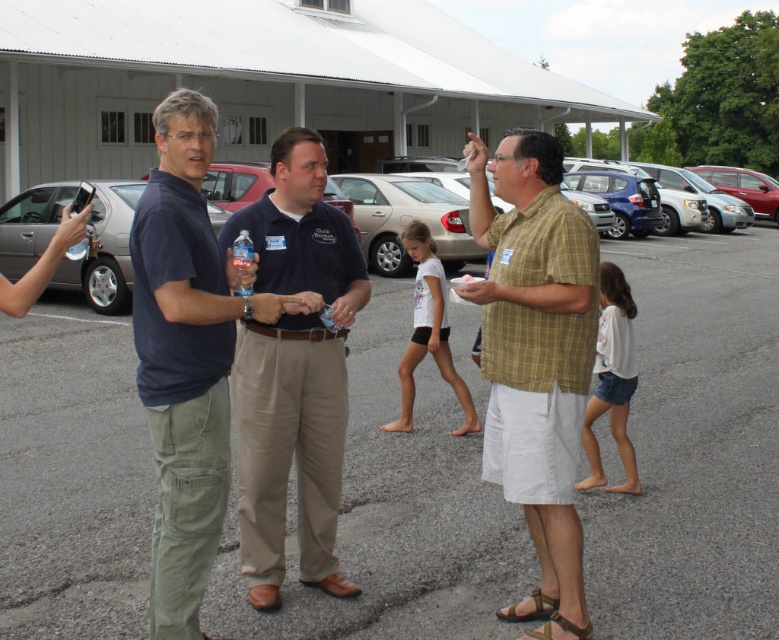
Question: Is dark blue shirt at center positioned behind metallic silver sedan at center?

Choices:
 (A) yes
 (B) no

Answer: (B)

Question: Which point is closer to the camera?

Choices:
 (A) (146, 339)
 (B) (314, 224)

Answer: (A)

Question: Which object is positioned closest to the metallic silver sedan at center?

Choices:
 (A) gray asphalt parking lot at center
 (B) yellow plaid shirt at center
 (C) dark blue shirt at center

Answer: (A)

Question: Can you confirm if yellow plaid shirt at center is positioned above khaki cotton pants at center?

Choices:
 (A) yes
 (B) no

Answer: (B)

Question: Which of the following is the closest to the observer?

Choices:
 (A) (686, 323)
 (B) (716, 237)

Answer: (A)

Question: Is yellow plaid shirt at center below dark blue shirt at center?

Choices:
 (A) no
 (B) yes

Answer: (B)